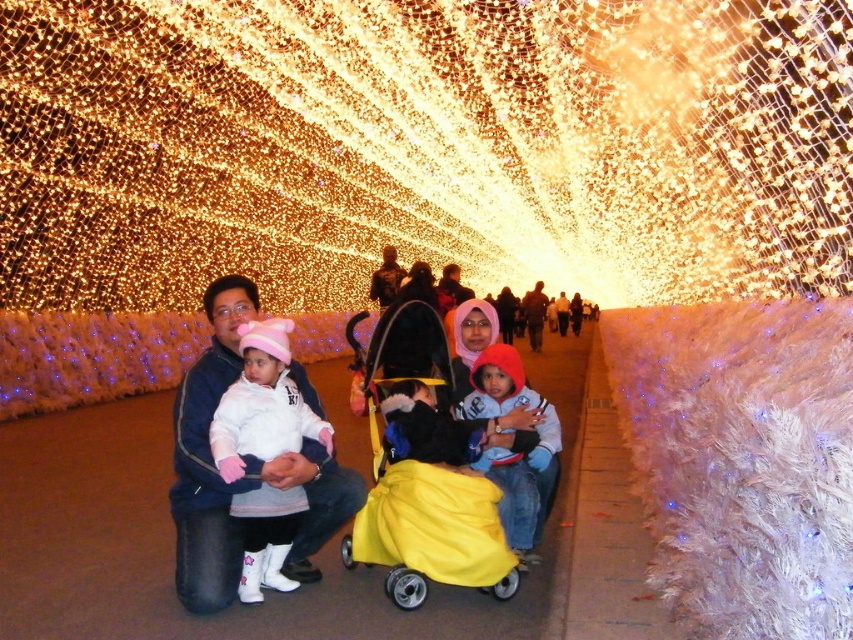
From the picture: Can you confirm if white fleece jacket at center is wider than light blue fleece jacket at center?

No, white fleece jacket at center is not wider than light blue fleece jacket at center.

Is white fleece jacket at center thinner than light blue fleece jacket at center?

Correct, white fleece jacket at center's width is less than light blue fleece jacket at center's.

At what (x,y) coordinates should I click in order to perform the action: click on white fleece jacket at center. Please return your answer as a coordinate pair (x, y). Image resolution: width=853 pixels, height=640 pixels. Looking at the image, I should click on (262, 404).

Consider the image. Is yellow fabric baby carriage at center in front of matte pink hoodie at center?

Yes, yellow fabric baby carriage at center is in front of matte pink hoodie at center.

Does yellow fabric baby carriage at center have a greater width compared to matte pink hoodie at center?

In fact, yellow fabric baby carriage at center might be narrower than matte pink hoodie at center.

Describe the element at coordinates (422, 470) in the screenshot. I see `yellow fabric baby carriage at center` at that location.

You are a GUI agent. You are given a task and a screenshot of the screen. Output one action in this format:
    pyautogui.click(x=<x>, y=<y>)
    Task: Click on the yellow fabric baby carriage at center
    The image size is (853, 640).
    Given the screenshot: What is the action you would take?
    pyautogui.click(x=422, y=470)

In the scene shown: Who is positioned more to the left, white fleece jacket at center or matte pink hoodie at center?

white fleece jacket at center is more to the left.

Between white fleece jacket at center and matte pink hoodie at center, which one has less height?

With less height is white fleece jacket at center.

The width and height of the screenshot is (853, 640). What are the coordinates of `white fleece jacket at center` in the screenshot? It's located at (262, 404).